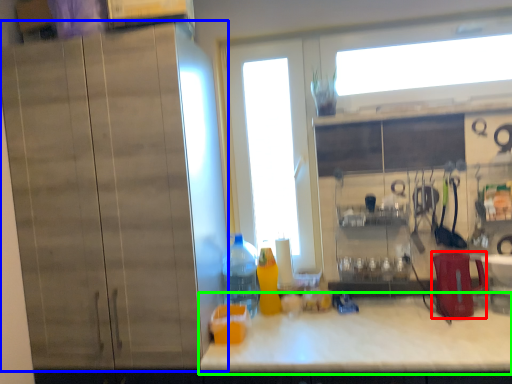
Question: Estimate the real-world distances between objects in this image. Which object is closer to appliance (highlighted by a red box), cabinetry (highlighted by a blue box) or countertop (highlighted by a green box)?

Choices:
 (A) cabinetry
 (B) countertop

Answer: (B)